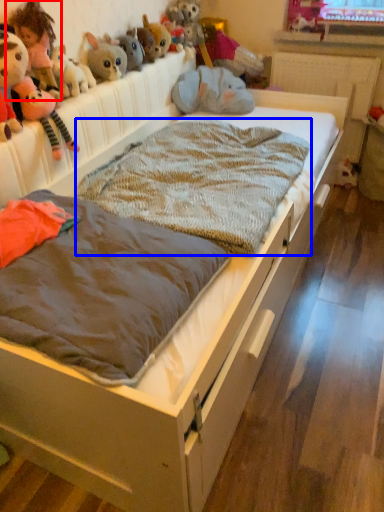
Question: Which of the following is the farthest to the observer, toy (highlighted by a red box) or blanket (highlighted by a blue box)?

Choices:
 (A) toy
 (B) blanket

Answer: (A)